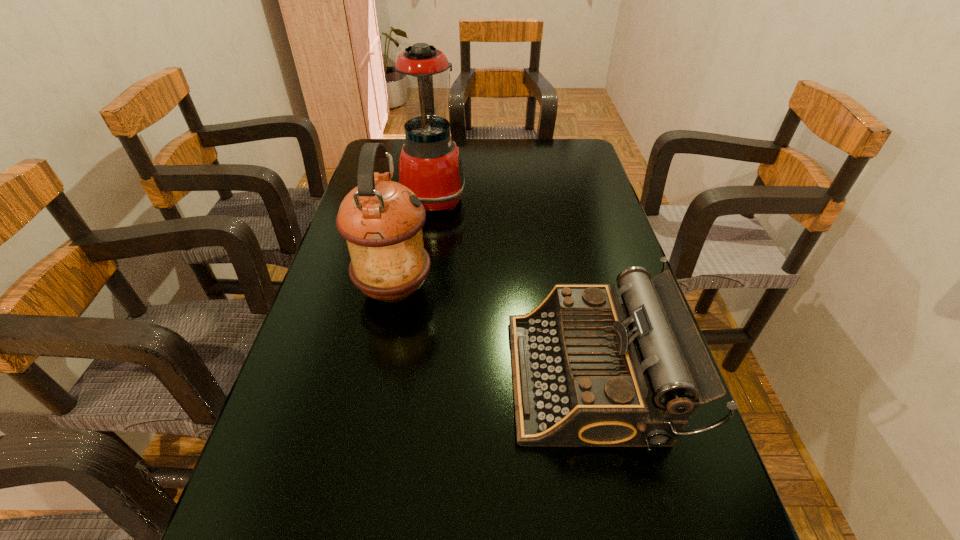
You are a GUI agent. You are given a task and a screenshot of the screen. Output one action in this format:
    pyautogui.click(x=<x>, y=<y>)
    Task: Click on the food processor
    
    Given the screenshot: What is the action you would take?
    pyautogui.click(x=430, y=165)

Find the location of `the tallest object`. the tallest object is located at coordinates (430, 165).

In order to click on the second tallest object in this screenshot , I will do `click(381, 220)`.

Find the location of a particular element. typewriter is located at coordinates 592,367.

At what (x,y) coordinates should I click in order to perform the action: click on the shortest object. Please return your answer as a coordinate pair (x, y). Looking at the image, I should click on (592, 367).

At what (x,y) coordinates should I click in order to perform the action: click on free spot located on the controls of the tallest object. Please return your answer as a coordinate pair (x, y). This screenshot has width=960, height=540. Looking at the image, I should click on [563, 198].

Identify the location of vacant space located on the right of the oil lamp. (523, 289).

Locate an element on the screen. The height and width of the screenshot is (540, 960). vacant region located on the keyboard of the rightmost object is located at coordinates (373, 377).

Identify the location of vacant region located on the keyboard of the rightmost object. (408, 377).

Where is `blank space located on the keyboard of the rightmost object`? This screenshot has width=960, height=540. blank space located on the keyboard of the rightmost object is located at coordinates (433, 377).